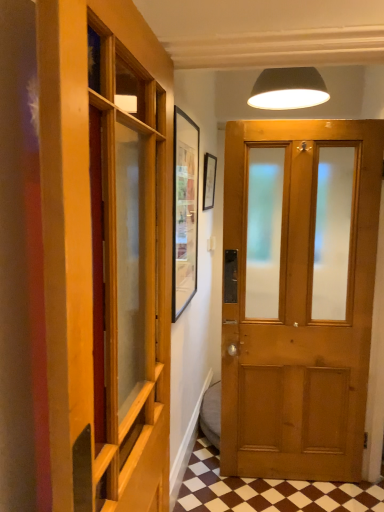
Locate an element on the screen. matte wooden door at center is located at coordinates [x=298, y=295].

In order to click on matte black lampshade at upper center in this screenshot , I will do `click(288, 89)`.

Identify the location of matte wooden door at center. (298, 295).

Considering the points (166, 146) and (262, 186), which point is behind, point (166, 146) or point (262, 186)?

The point (262, 186) is behind.

Based on the photo, from a real-world perspective, which object rests below the other?

In real-world perspective, wooden paneling at left is lower.

Is wooden paneling at left inside the boundaries of matte wooden door at center, or outside?

wooden paneling at left is not inside matte wooden door at center, it's outside.

Is wooden paneling at left to the right of matte wooden door at center from the viewer's perspective?

Incorrect, wooden paneling at left is not on the right side of matte wooden door at center.

From the image's perspective, is matte black lampshade at upper center over wooden paneling at left?

Indeed, from the image's perspective, matte black lampshade at upper center is shown above wooden paneling at left.

Can you confirm if matte black lampshade at upper center is taller than wooden paneling at left?

Incorrect, the height of matte black lampshade at upper center is not larger of that of wooden paneling at left.

Consider the image. Which is closer, (258, 98) or (142, 272)?

Clearly, point (258, 98) is more distant from the camera than point (142, 272).

From a real-world perspective, who is located lower, brown checkered tile at lower center or matte black lampshade at upper center?

brown checkered tile at lower center, from a real-world perspective.

From the picture: Considering their positions, is brown checkered tile at lower center located in front of or behind matte black lampshade at upper center?

brown checkered tile at lower center is in front of matte black lampshade at upper center.

Is brown checkered tile at lower center facing away from matte black lampshade at upper center?

No, brown checkered tile at lower center is not facing the opposite direction of matte black lampshade at upper center.

Based on the photo, how many degrees apart are the facing directions of brown checkered tile at lower center and matte black lampshade at upper center?

5.43 degrees.

Can you confirm if wooden paneling at left is positioned to the right of brown checkered tile at lower center?

In fact, wooden paneling at left is to the left of brown checkered tile at lower center.

Is wooden paneling at left positioned far away from brown checkered tile at lower center?

Indeed, wooden paneling at left is not near brown checkered tile at lower center.

Measure the distance between wooden paneling at left and brown checkered tile at lower center.

The distance of wooden paneling at left from brown checkered tile at lower center is 1.32 meters.

Considering the positions of objects wooden paneling at left and brown checkered tile at lower center in the image provided, who is in front, wooden paneling at left or brown checkered tile at lower center?

wooden paneling at left is more forward.

Which is behind, point (133, 262) or point (299, 70)?

Point (133, 262)

Is wooden paneling at left touching matte black lampshade at upper center?

wooden paneling at left and matte black lampshade at upper center are clearly separated.

Can you tell me how much wooden paneling at left and matte black lampshade at upper center differ in facing direction?

There is a 87.2-degree angle between the facing directions of wooden paneling at left and matte black lampshade at upper center.

Can you confirm if wooden paneling at left is thinner than matte black lampshade at upper center?

Correct, the width of wooden paneling at left is less than that of matte black lampshade at upper center.

Who is taller, matte black lampshade at upper center or matte wooden door at center?

matte wooden door at center.

How much distance is there between matte black lampshade at upper center and matte wooden door at center?

A distance of 30.97 inches exists between matte black lampshade at upper center and matte wooden door at center.

Does matte black lampshade at upper center have a smaller size compared to matte wooden door at center?

Yes, matte black lampshade at upper center is smaller than matte wooden door at center.

From the image's perspective, is matte black lampshade at upper center above matte wooden door at center?

Yes, from the image's perspective, matte black lampshade at upper center is on top of matte wooden door at center.

From the image's perspective, which one is positioned higher, matte black lampshade at upper center or brown checkered tile at lower center?

matte black lampshade at upper center.

From a real-world perspective, is matte black lampshade at upper center positioned above or below brown checkered tile at lower center?

In terms of real-world spatial position, matte black lampshade at upper center is above brown checkered tile at lower center.

Which of these two, matte black lampshade at upper center or brown checkered tile at lower center, is thinner?

matte black lampshade at upper center.

Are matte black lampshade at upper center and brown checkered tile at lower center located far from each other?

Yes, matte black lampshade at upper center and brown checkered tile at lower center are quite far apart.

Image resolution: width=384 pixels, height=512 pixels. In order to click on door located above the wooden paneling at left (from the image's perspective) in this screenshot , I will do `click(298, 295)`.

Locate an element on the screen. elevator lying below the matte black lampshade at upper center (from the image's perspective) is located at coordinates (103, 268).

Based on their spatial positions, is wooden paneling at left or matte black lampshade at upper center closer to brown checkered tile at lower center?

wooden paneling at left is closer to brown checkered tile at lower center.

Estimate the real-world distances between objects in this image. Which object is closer to brown checkered tile at lower center, matte black lampshade at upper center or wooden paneling at left?

Based on the image, wooden paneling at left appears to be nearer to brown checkered tile at lower center.

From the image, which object appears to be nearer to brown checkered tile at lower center, matte wooden door at center or wooden paneling at left?

Among the two, matte wooden door at center is located nearer to brown checkered tile at lower center.

From the picture: Which object lies nearer to the anchor point wooden paneling at left, brown checkered tile at lower center or matte black lampshade at upper center?

matte black lampshade at upper center is positioned closer to the anchor wooden paneling at left.

Looking at the image, which one is located closer to wooden paneling at left, matte wooden door at center or brown checkered tile at lower center?

matte wooden door at center is closer to wooden paneling at left.

Looking at the image, which one is located closer to matte wooden door at center, brown checkered tile at lower center or matte black lampshade at upper center?

brown checkered tile at lower center lies closer to matte wooden door at center than the other object.

Which object lies further to the anchor point wooden paneling at left, matte wooden door at center or matte black lampshade at upper center?

Based on the image, matte black lampshade at upper center appears to be further to wooden paneling at left.

Considering their positions, is wooden paneling at left positioned closer to matte wooden door at center than brown checkered tile at lower center?

The object closer to matte wooden door at center is brown checkered tile at lower center.

Image resolution: width=384 pixels, height=512 pixels. I want to click on door positioned between wooden paneling at left and brown checkered tile at lower center from near to far, so click(x=298, y=295).

At what (x,y) coordinates should I click in order to perform the action: click on elevator between matte black lampshade at upper center and brown checkered tile at lower center in the up-down direction. Please return your answer as a coordinate pair (x, y). The width and height of the screenshot is (384, 512). Looking at the image, I should click on (103, 268).

The height and width of the screenshot is (512, 384). I want to click on door between matte black lampshade at upper center and brown checkered tile at lower center vertically, so click(298, 295).

This screenshot has width=384, height=512. Find the location of `door between wooden paneling at left and matte black lampshade at upper center in the front-back direction`. door between wooden paneling at left and matte black lampshade at upper center in the front-back direction is located at coordinates (298, 295).